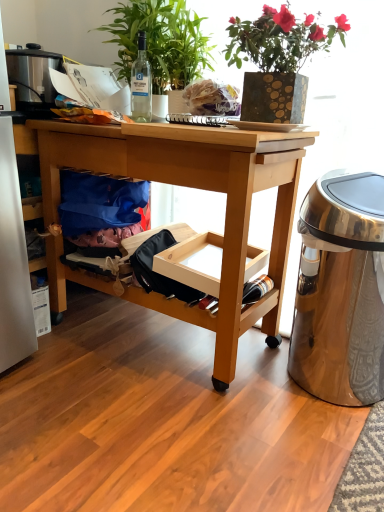
Question: Is gold textured vase at upper center, the 3th houseplant in the left-to-right sequence, wider than green leafy plant at upper center, which is the 2th houseplant from right to left?

Choices:
 (A) no
 (B) yes

Answer: (B)

Question: Considering the relative positions of gold textured vase at upper center, the 3th houseplant in the left-to-right sequence, and green leafy plant at upper center, which is the 2th houseplant from right to left, in the image provided, is gold textured vase at upper center, the 3th houseplant in the left-to-right sequence, to the right of green leafy plant at upper center, which is the 2th houseplant from right to left, from the viewer's perspective?

Choices:
 (A) yes
 (B) no

Answer: (A)

Question: Is gold textured vase at upper center, the 3th houseplant in the left-to-right sequence, thinner than green leafy plant at upper center, which is the 2th houseplant from right to left?

Choices:
 (A) no
 (B) yes

Answer: (A)

Question: From the image's perspective, is gold textured vase at upper center, which appears as the first houseplant when viewed from the right, under green leafy plant at upper center, which is the 2th houseplant from right to left?

Choices:
 (A) no
 (B) yes

Answer: (B)

Question: Is gold textured vase at upper center, the 3th houseplant in the left-to-right sequence, to the left of green leafy plant at upper center, acting as the second houseplant starting from the left, from the viewer's perspective?

Choices:
 (A) no
 (B) yes

Answer: (A)

Question: Does gold textured vase at upper center, which appears as the first houseplant when viewed from the right, have a smaller size compared to green leafy plant at upper center, which is the 2th houseplant from right to left?

Choices:
 (A) no
 (B) yes

Answer: (A)

Question: Is gold textured vase at upper center, which appears as the first houseplant when viewed from the right, in contact with polished metallic trash can at right?

Choices:
 (A) yes
 (B) no

Answer: (B)

Question: Is gold textured vase at upper center, the 3th houseplant in the left-to-right sequence, thinner than polished metallic trash can at right?

Choices:
 (A) no
 (B) yes

Answer: (A)

Question: From the image's perspective, is gold textured vase at upper center, which appears as the first houseplant when viewed from the right, on top of polished metallic trash can at right?

Choices:
 (A) no
 (B) yes

Answer: (B)

Question: From a real-world perspective, does gold textured vase at upper center, which appears as the first houseplant when viewed from the right, stand above polished metallic trash can at right?

Choices:
 (A) yes
 (B) no

Answer: (A)

Question: Is gold textured vase at upper center, which appears as the first houseplant when viewed from the right, oriented away from polished metallic trash can at right?

Choices:
 (A) no
 (B) yes

Answer: (A)

Question: Is polished metallic trash can at right located within gold textured vase at upper center, which appears as the first houseplant when viewed from the right?

Choices:
 (A) no
 (B) yes

Answer: (A)

Question: Does white matte plate at center turn towards gold textured vase at upper center, the 3th houseplant in the left-to-right sequence?

Choices:
 (A) no
 (B) yes

Answer: (A)